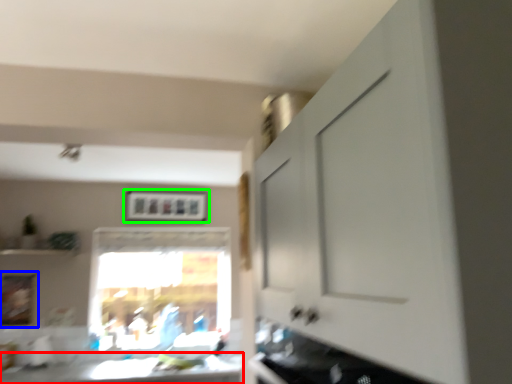
Question: Which is farther away from counter top (highlighted by a red box)? picture frame (highlighted by a blue box) or picture frame (highlighted by a green box)?

Choices:
 (A) picture frame
 (B) picture frame

Answer: (B)